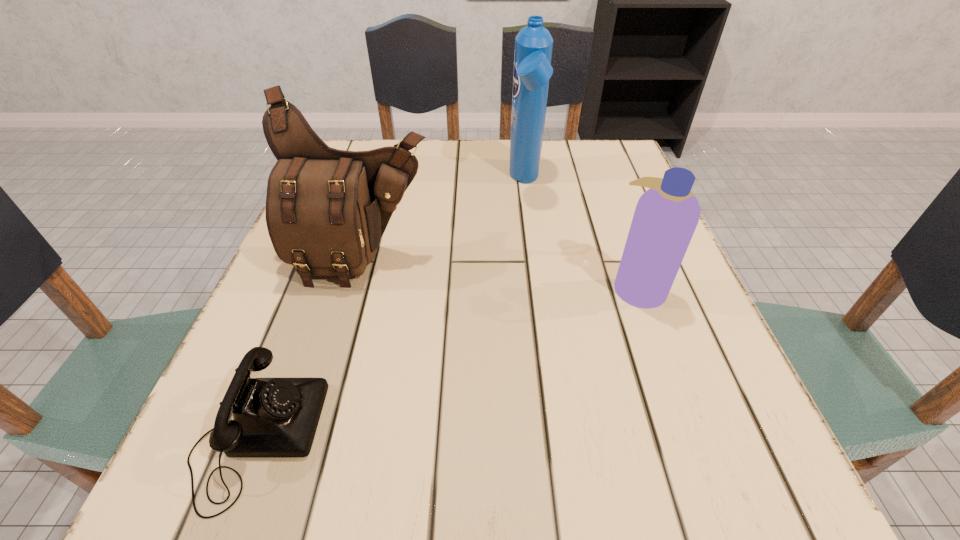
What are the coordinates of `vacant space that is in between the third object from left to right and the shortest object` in the screenshot? It's located at (391, 309).

Where is `empty space that is in between the nearer shampoo and the shoulder bag`? The image size is (960, 540). empty space that is in between the nearer shampoo and the shoulder bag is located at coordinates (500, 273).

Image resolution: width=960 pixels, height=540 pixels. I want to click on free space between the shoulder bag and the farthest object, so click(x=444, y=220).

Point out which object is positioned as the second nearest to the shorter shampoo. Please provide its 2D coordinates. Your answer should be formatted as a tuple, i.e. [(x, y)], where the tuple contains the x and y coordinates of a point satisfying the conditions above.

[(326, 209)]

This screenshot has width=960, height=540. I want to click on object that ranks as the closest to the shoulder bag, so click(272, 417).

This screenshot has height=540, width=960. I want to click on vacant space that satisfies the following two spatial constraints: 1. on the front-facing side of the shoulder bag; 2. on the right side of the shorter shampoo, so click(355, 288).

Locate an element on the screen. Image resolution: width=960 pixels, height=540 pixels. free space that satisfies the following two spatial constraints: 1. on the front-facing side of the shoulder bag; 2. on the front face of the nearest object is located at coordinates (313, 436).

In order to click on blank area in the image that satisfies the following two spatial constraints: 1. on the front-facing side of the rightmost object; 2. on the left side of the shoulder bag in this screenshot , I will do `click(355, 288)`.

At what (x,y) coordinates should I click in order to perform the action: click on free space that satisfies the following two spatial constraints: 1. on the front side of the taller shampoo; 2. on the left side of the right shampoo. Please return your answer as a coordinate pair (x, y). Looking at the image, I should click on (540, 288).

Where is `free spot that satisfies the following two spatial constraints: 1. on the front-facing side of the nearer shampoo; 2. on the left side of the shoulder bag`? This screenshot has width=960, height=540. free spot that satisfies the following two spatial constraints: 1. on the front-facing side of the nearer shampoo; 2. on the left side of the shoulder bag is located at coordinates (355, 288).